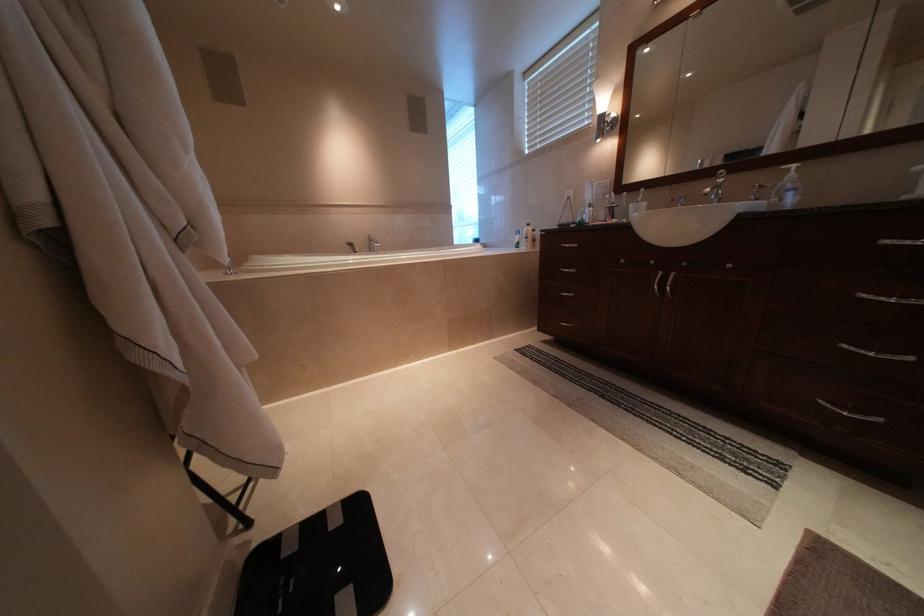
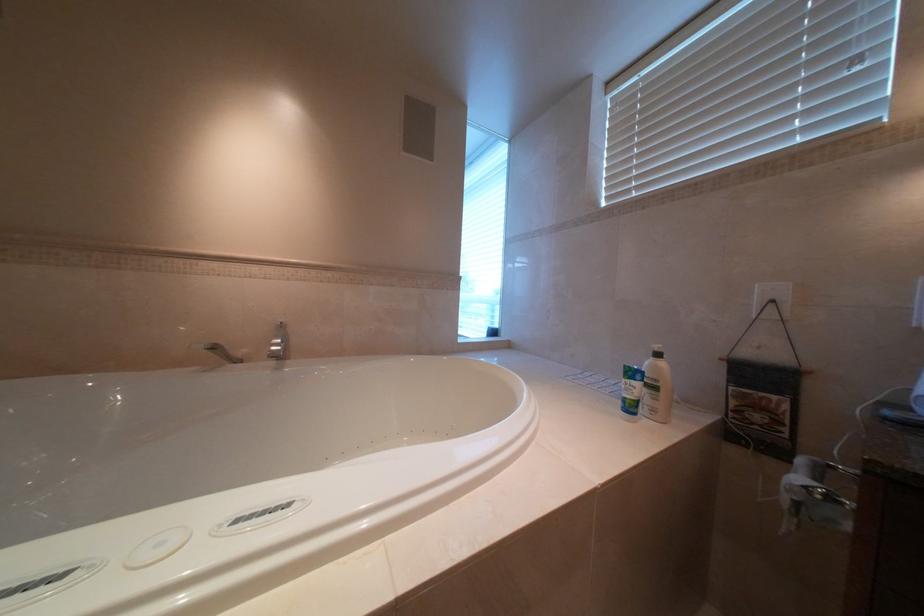
Question: In a continuous first-person perspective shot, in which direction is the camera moving?

Choices:
 (A) Left
 (B) Right
 (C) Forward
 (D) Backward

Answer: (C)